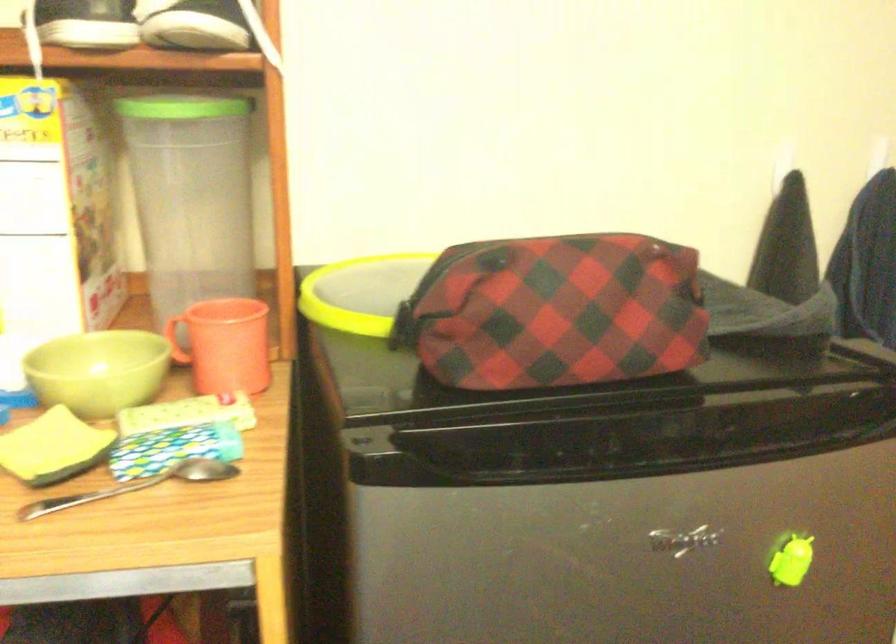
Image resolution: width=896 pixels, height=644 pixels. Find the location of `orange mug handle`. orange mug handle is located at coordinates (224, 345).